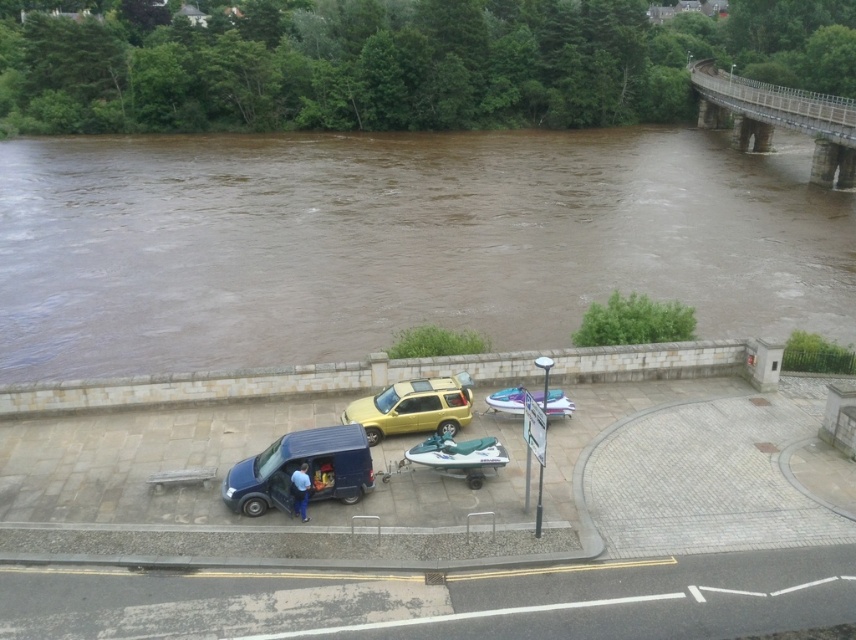
Is matte black van at lower left smaller than yellow matte suv at center?

Yes, matte black van at lower left is smaller than yellow matte suv at center.

Which of these two, matte black van at lower left or yellow matte suv at center, stands taller?

matte black van at lower left

This screenshot has height=640, width=856. Describe the element at coordinates (300, 467) in the screenshot. I see `matte black van at lower left` at that location.

The height and width of the screenshot is (640, 856). In order to click on matte black van at lower left in this screenshot , I will do tap(300, 467).

Who is more distant from viewer, (125, 164) or (785, 109)?

Answer: The point (125, 164) is behind.

Which is more to the left, brown muddy water at center or concrete gray bridge at upper right?

brown muddy water at center

Locate an element on the screen. The width and height of the screenshot is (856, 640). brown muddy water at center is located at coordinates (397, 243).

Is point (770, 131) behind point (349, 419)?

Yes, point (770, 131) is farther from viewer.

From the picture: Does concrete gray bridge at upper right have a larger size compared to yellow matte suv at center?

Yes, concrete gray bridge at upper right is bigger than yellow matte suv at center.

What do you see at coordinates (780, 118) in the screenshot?
I see `concrete gray bridge at upper right` at bounding box center [780, 118].

The height and width of the screenshot is (640, 856). I want to click on concrete gray bridge at upper right, so coord(780,118).